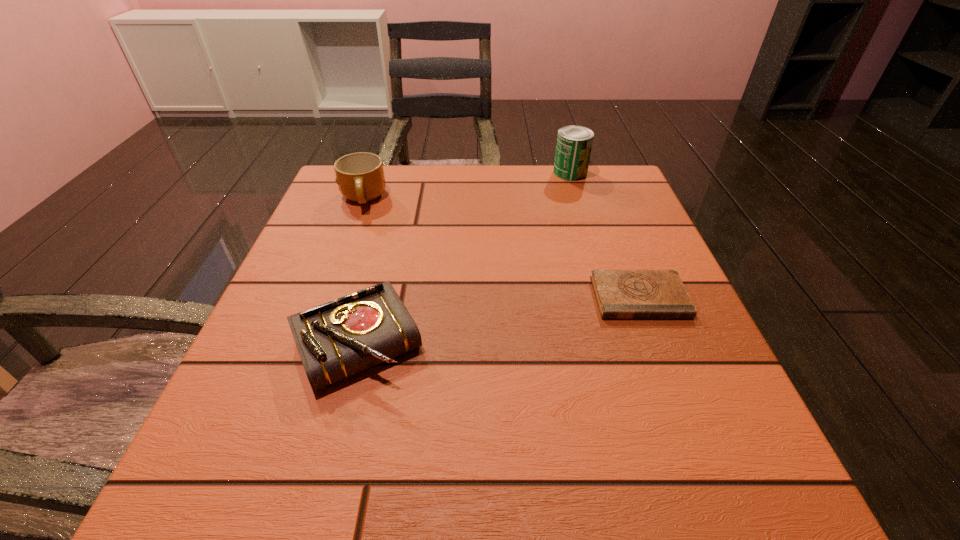
Identify the location of vacant region that satisfies the following two spatial constraints: 1. on the side with the handle of the third tallest object; 2. on the left side of the second farthest object. Image resolution: width=960 pixels, height=540 pixels. (310, 344).

You are a GUI agent. You are given a task and a screenshot of the screen. Output one action in this format:
    pyautogui.click(x=<x>, y=<y>)
    Task: Click on the vacant space that satisfies the following two spatial constraints: 1. on the side with the handle of the second farthest object; 2. on the left side of the left diary
    This screenshot has width=960, height=540.
    Given the screenshot: What is the action you would take?
    (x=310, y=344)